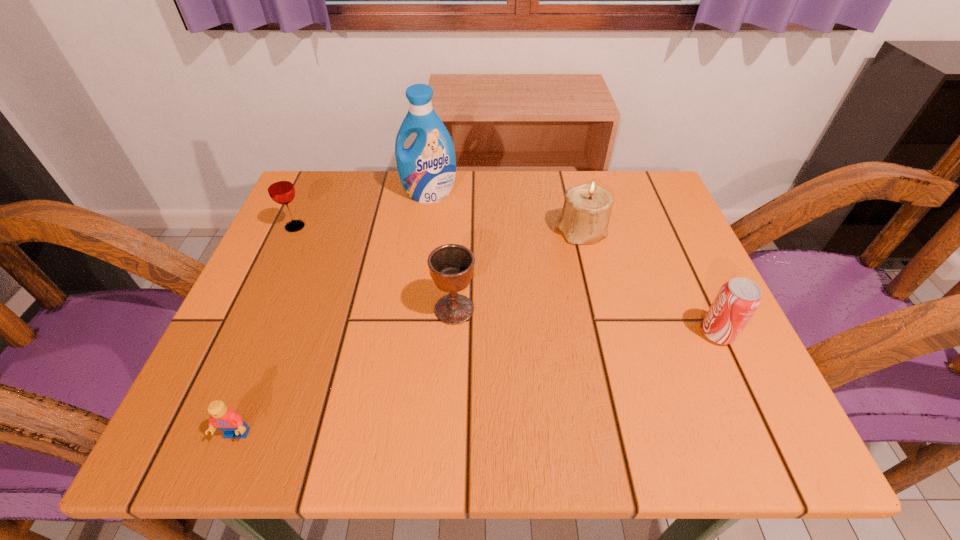
Identify the location of Lego situated at the left edge. The image size is (960, 540). (227, 420).

Image resolution: width=960 pixels, height=540 pixels. In order to click on object at the right edge in this screenshot , I will do `click(738, 299)`.

Identify the location of object that is at the far left corner. (281, 190).

Where is `object located in the near left corner section of the desktop`? The image size is (960, 540). object located in the near left corner section of the desktop is located at coordinates (227, 420).

In the image, there is a desktop. Identify the location of vacant region at the far edge. (381, 217).

In the image, there is a desktop. Where is `free region at the left edge`? Image resolution: width=960 pixels, height=540 pixels. free region at the left edge is located at coordinates (312, 249).

The width and height of the screenshot is (960, 540). Identify the location of free space at the right edge. (738, 373).

Image resolution: width=960 pixels, height=540 pixels. In order to click on free location at the far left corner of the desktop in this screenshot , I will do `click(308, 215)`.

Find the location of a particular element. This screenshot has height=540, width=960. free spot between the fifth object from left to right and the Lego is located at coordinates (409, 334).

I want to click on free space between the Lego and the chalice, so click(346, 372).